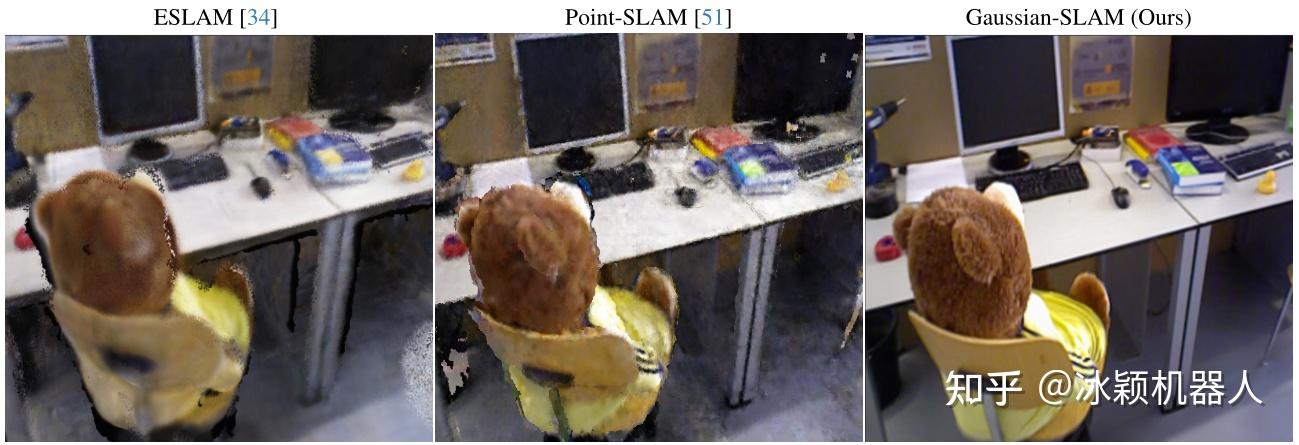
The width and height of the screenshot is (1299, 445). What are the coordinates of `computer moniter` in the screenshot? It's located at (148, 74).